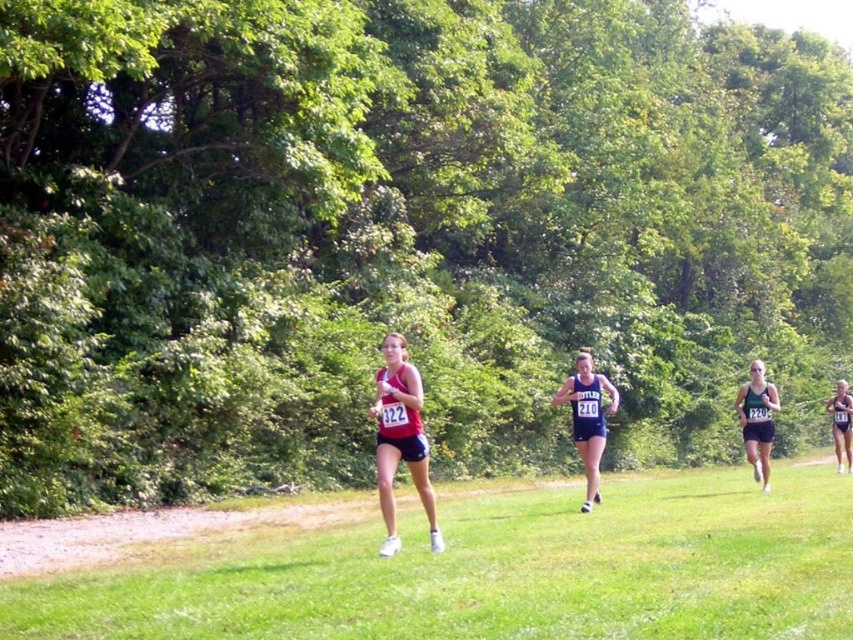
Question: Can you confirm if green grass at center is positioned above blue athletic uniform at center?

Choices:
 (A) no
 (B) yes

Answer: (A)

Question: Considering the real-world distances, which object is closest to the black athletic wear at right?

Choices:
 (A) matte blue tank top at right
 (B) matte red tank top at center
 (C) blue athletic uniform at center
 (D) green grass at center

Answer: (D)

Question: Among these objects, which one is nearest to the camera?

Choices:
 (A) matte red tank top at center
 (B) matte blue tank top at right
 (C) blue athletic uniform at center

Answer: (A)

Question: Can you confirm if matte red tank top at center is smaller than black athletic wear at right?

Choices:
 (A) yes
 (B) no

Answer: (A)

Question: Which point is closer to the camera?

Choices:
 (A) black athletic wear at right
 (B) matte blue tank top at right
 (C) blue athletic uniform at center
 (D) green grass at center

Answer: (D)

Question: Does green grass at center appear over matte blue tank top at right?

Choices:
 (A) no
 (B) yes

Answer: (B)